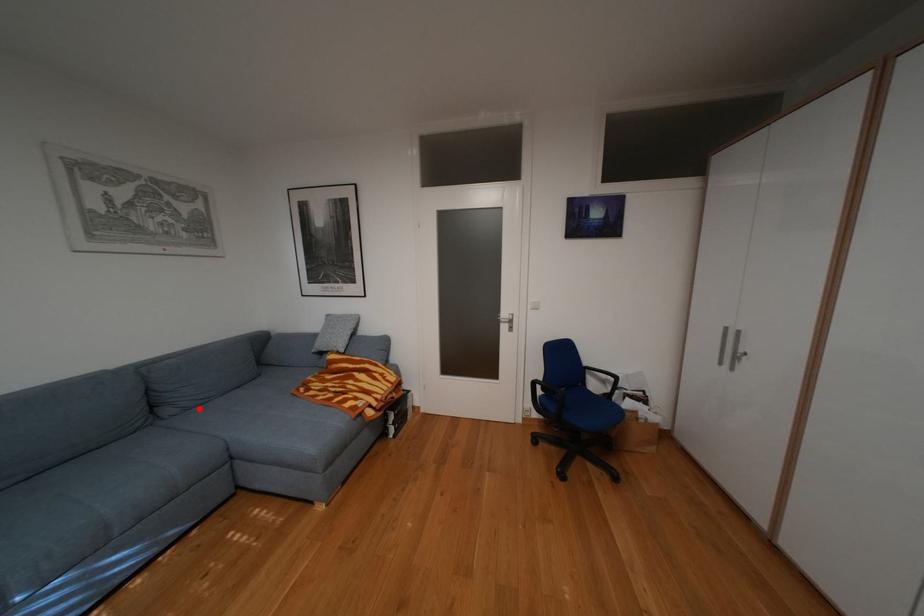
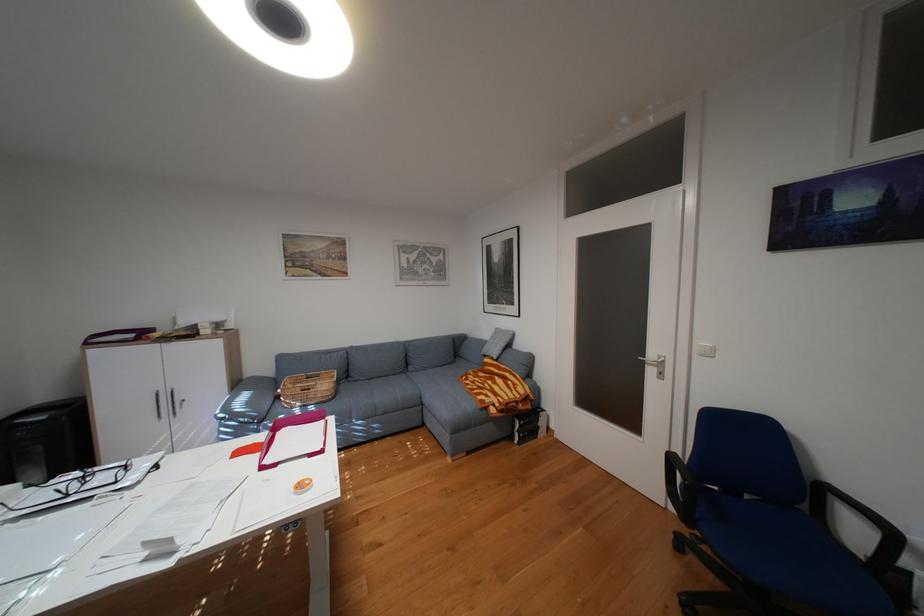
The point at the highlighted location is marked in the first image. Where is the corresponding point in the second image?

(430, 370)